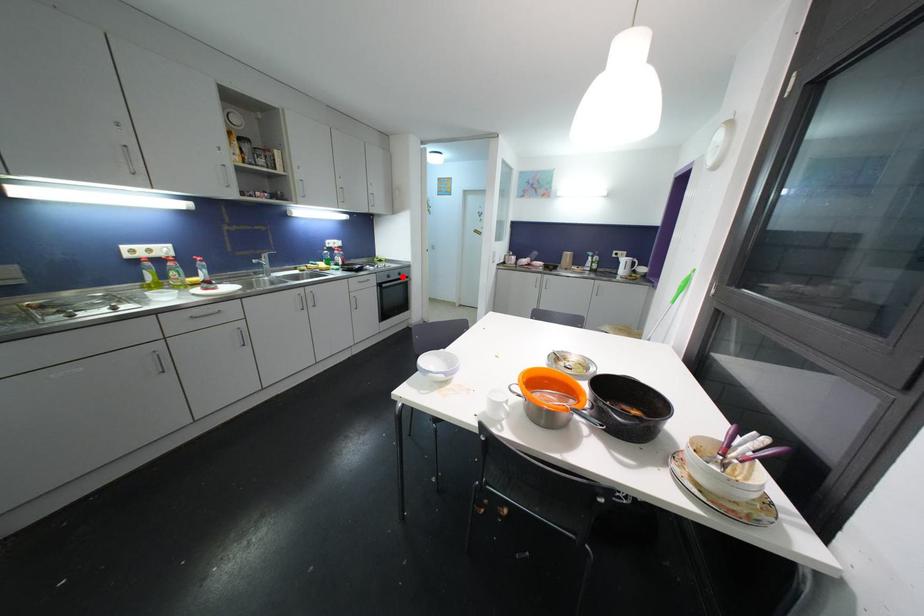
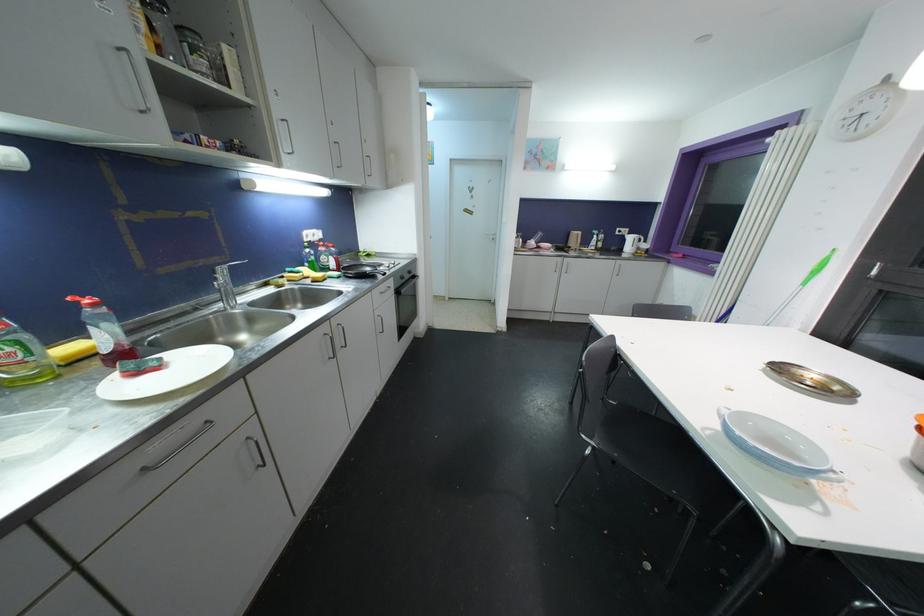
Question: I am providing you with two images of the same scene from different viewpoints. Image1 has a red point marked. In image2, the corresponding 3D location appears at what relative position? Reply with the corresponding letter.

Choices:
 (A) Closer
 (B) Farther

Answer: (A)